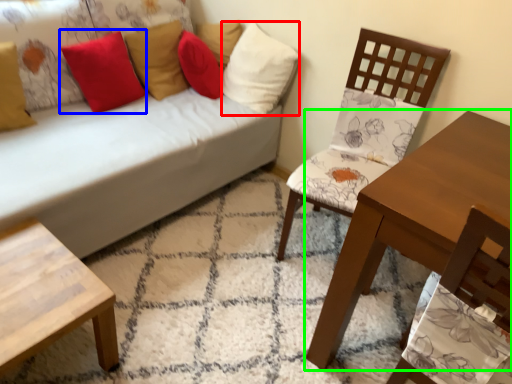
Question: Based on their relative distances, which object is farther from pillow (highlighted by a red box)? Choose from pillow (highlighted by a blue box) and table (highlighted by a green box).

Choices:
 (A) pillow
 (B) table

Answer: (B)